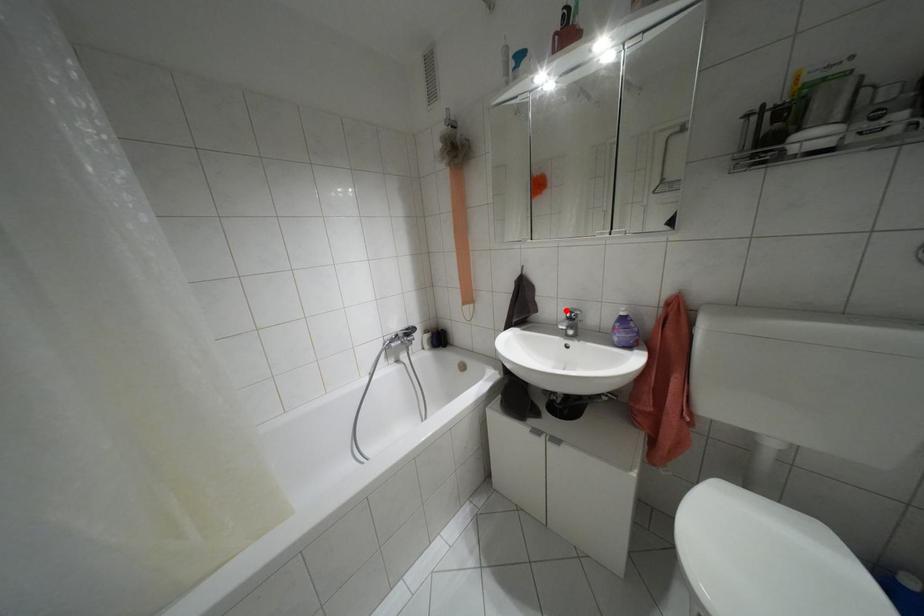
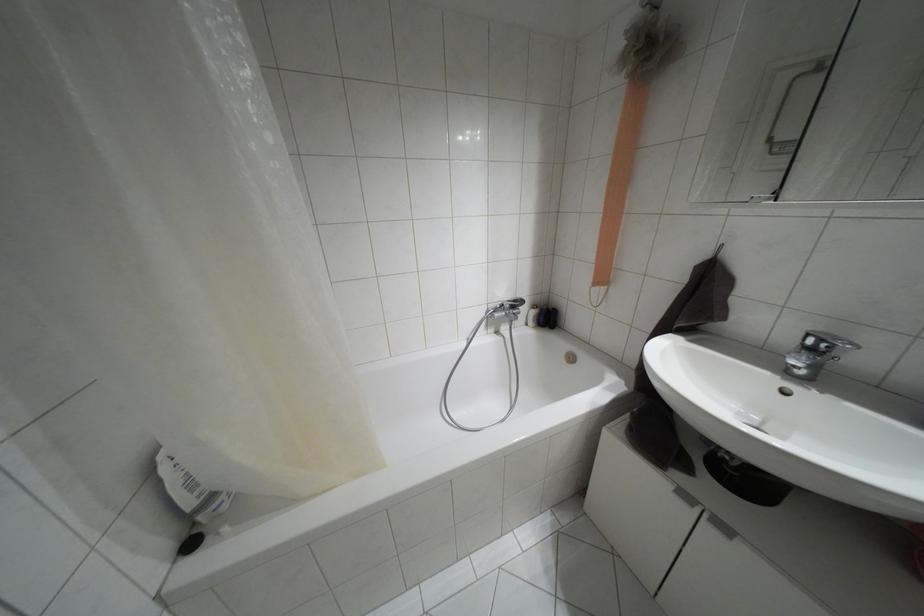
Find the pixel in the second image that matches the highlighted location in the first image.

(808, 334)